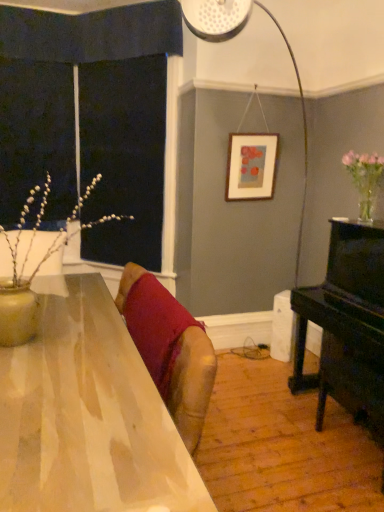
Question: Choose the correct answer: Is shiny wooden table at center inside black polished piano at right or outside it?

Choices:
 (A) outside
 (B) inside

Answer: (A)

Question: Considering the positions of point (100, 374) and point (296, 352), is point (100, 374) closer or farther from the camera than point (296, 352)?

Choices:
 (A) farther
 (B) closer

Answer: (B)

Question: Based on their relative distances, which object is nearer to the matte wooden picture frame at upper center?

Choices:
 (A) translucent glass vase at right
 (B) black polished piano at right
 (C) shiny wooden table at center
 (D) velvet red cushion at center

Answer: (A)

Question: Based on their relative distances, which object is nearer to the matte wooden picture frame at upper center?

Choices:
 (A) velvet red cushion at center
 (B) black polished piano at right
 (C) shiny wooden table at center
 (D) translucent glass vase at right

Answer: (D)